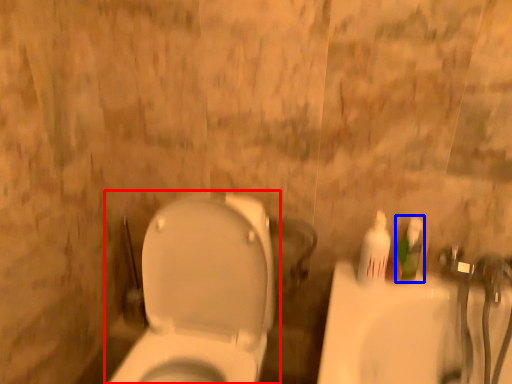
Question: Which object appears farthest to the camera in this image, toilet (highlighted by a red box) or mouthwash (highlighted by a blue box)?

Choices:
 (A) toilet
 (B) mouthwash

Answer: (B)